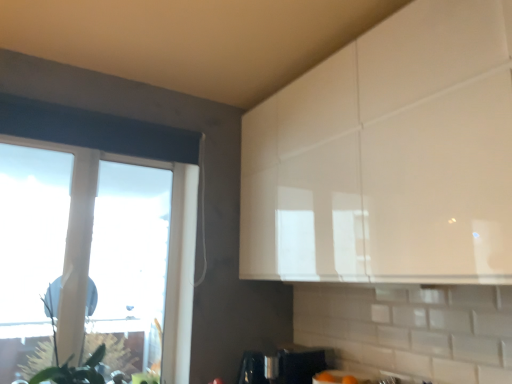
Question: Is green matte plant at left in front of or behind transparent glass window at left in the image?

Choices:
 (A) behind
 (B) front

Answer: (B)

Question: From a real-world perspective, is green matte plant at left above or below transparent glass window at left?

Choices:
 (A) above
 (B) below

Answer: (B)

Question: Which of these objects is positioned closest to the transparent glass window at left?

Choices:
 (A) green matte plant at left
 (B) satin silver coffee maker at lower center

Answer: (B)

Question: Which object is the farthest from the transparent glass window at left?

Choices:
 (A) green matte plant at left
 (B) satin silver coffee maker at lower center

Answer: (A)